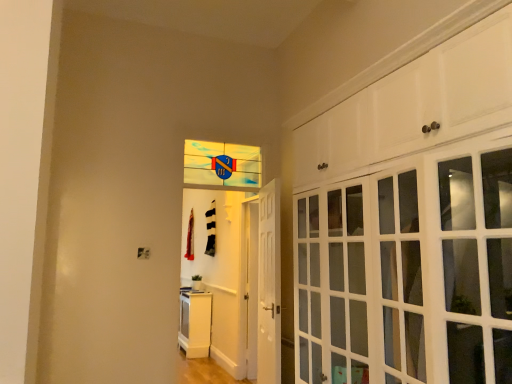
You are a GUI agent. You are given a task and a screenshot of the screen. Output one action in this format:
    pyautogui.click(x=<x>, y=<y>)
    Task: Click on the free space above translucent glass window at center (from a real-world perspective)
    The image size is (512, 384).
    Given the screenshot: What is the action you would take?
    pyautogui.click(x=219, y=131)